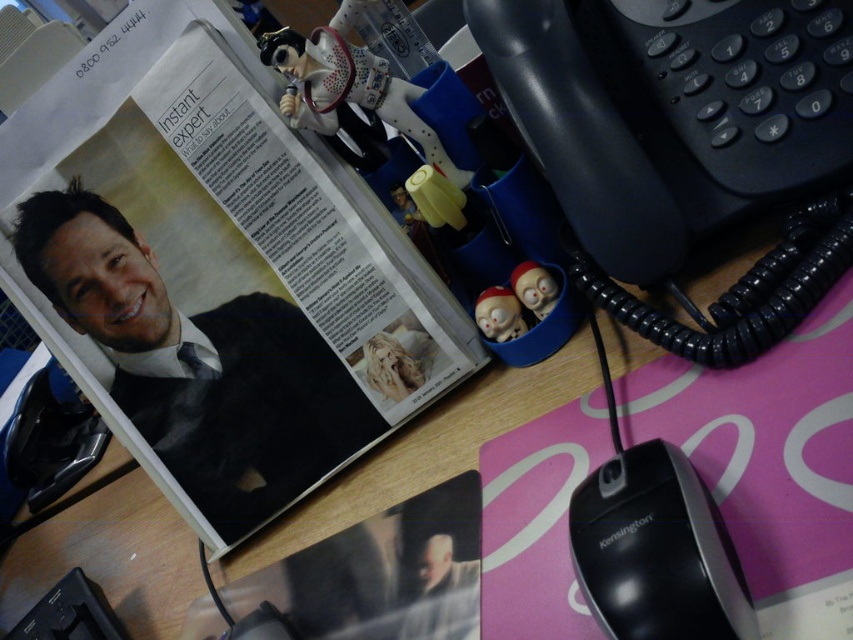
You are organizing the desk and want to place a new item between the matte black suit at upper left and the black plastic mouse at lower right. Can you fit it there?

The black plastic mouse at lower right is behind matte black suit at upper left, so there is no space between them for placing a new item.

You are organizing items on a desk and need to place a new item between the matte black suit at upper left and the black plastic mouse at lower right. Can you fit it there?

The matte black suit at upper left is to the left of the black plastic mouse at lower right, so there is space between them to fit a new item.

You are organizing items on a desk and need to place a new item between the matte black suit at upper left and the black plastic mouse at lower right. Based on their positions, where should you place the new item?

The new item should be placed between the matte black suit at upper left and the black plastic mouse at lower right, positioning it somewhere in the middle area between the upper left and lower right positions.